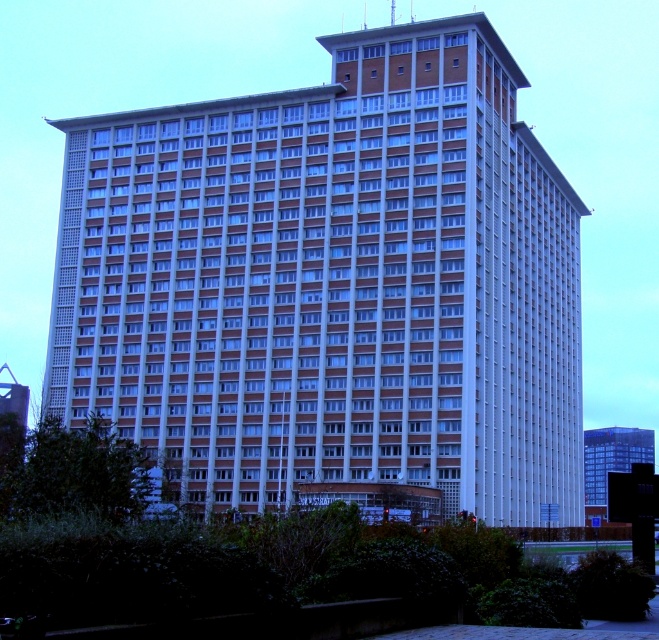
Question: Can you confirm if white brick building at center is positioned to the left of glassy blue skyscraper at center?

Choices:
 (A) no
 (B) yes

Answer: (B)

Question: Does white brick building at center have a larger size compared to glassy blue skyscraper at center?

Choices:
 (A) yes
 (B) no

Answer: (A)

Question: Is the position of white brick building at center less distant than that of glassy blue skyscraper at center?

Choices:
 (A) yes
 (B) no

Answer: (A)

Question: Among these points, which one is nearest to the camera?

Choices:
 (A) tap(606, 456)
 (B) tap(326, 464)

Answer: (B)